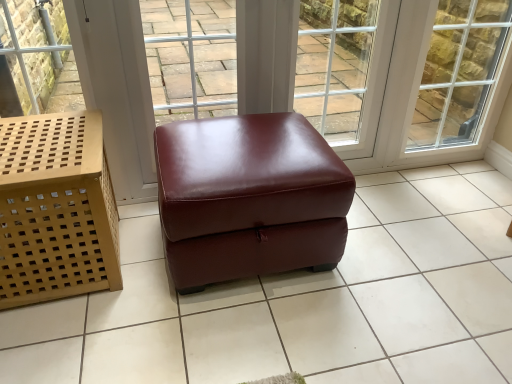
Where is `empty space that is ontop of light brown woven basket at left`? empty space that is ontop of light brown woven basket at left is located at coordinates (53, 141).